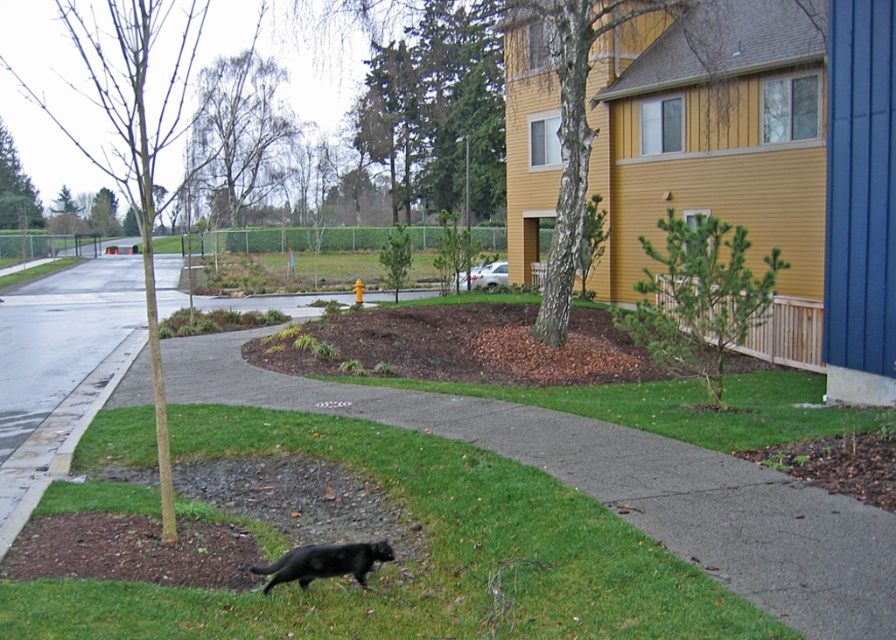
Which is behind, point (599, 566) or point (304, 580)?

Point (599, 566)

Can you confirm if green grass at lower center is bigger than black furry cat at lower center?

No, green grass at lower center is not bigger than black furry cat at lower center.

Is point (593, 547) less distant than point (256, 573)?

No, (593, 547) is further to viewer.

In order to click on green grass at lower center in this screenshot , I will do `click(411, 560)`.

Is green grass at lower center thinner than brown mulch at center?

Correct, green grass at lower center's width is less than brown mulch at center's.

Can you confirm if green grass at lower center is smaller than brown mulch at center?

Yes, green grass at lower center is smaller than brown mulch at center.

Who is more forward, [625,538] or [599,378]?

Point [625,538] is more forward.

Find the location of a particular element. Image resolution: width=896 pixels, height=640 pixels. green grass at lower center is located at coordinates (411, 560).

Between brown mulch at center and black furry cat at lower center, which one appears on the right side from the viewer's perspective?

From the viewer's perspective, brown mulch at center appears more on the right side.

Identify the location of brown mulch at center. tap(458, 346).

Between point (403, 323) and point (363, 557), which one is positioned behind?

The point (403, 323) is behind.

Where is `brown mulch at center`? brown mulch at center is located at coordinates (458, 346).